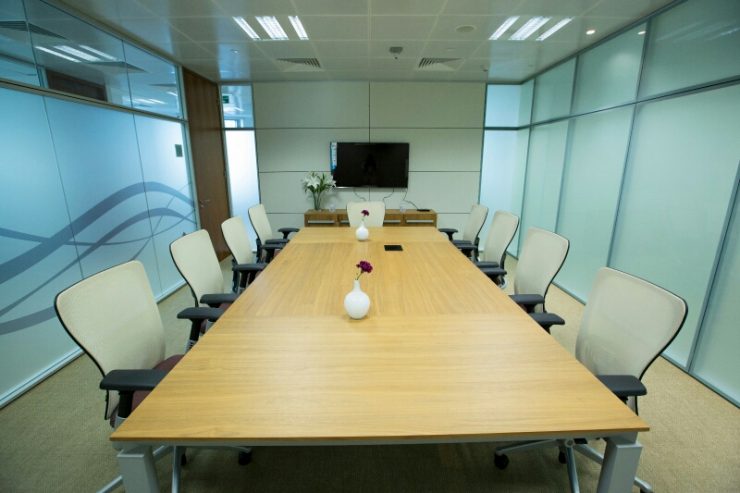
You are a GUI agent. You are given a task and a screenshot of the screen. Output one action in this format:
    pyautogui.click(x=<x>, y=<y>)
    Task: Click on the back rests
    
    Given the screenshot: What is the action you would take?
    pyautogui.click(x=118, y=319), pyautogui.click(x=201, y=261), pyautogui.click(x=240, y=238), pyautogui.click(x=260, y=218), pyautogui.click(x=473, y=222), pyautogui.click(x=494, y=233), pyautogui.click(x=536, y=262), pyautogui.click(x=621, y=335)